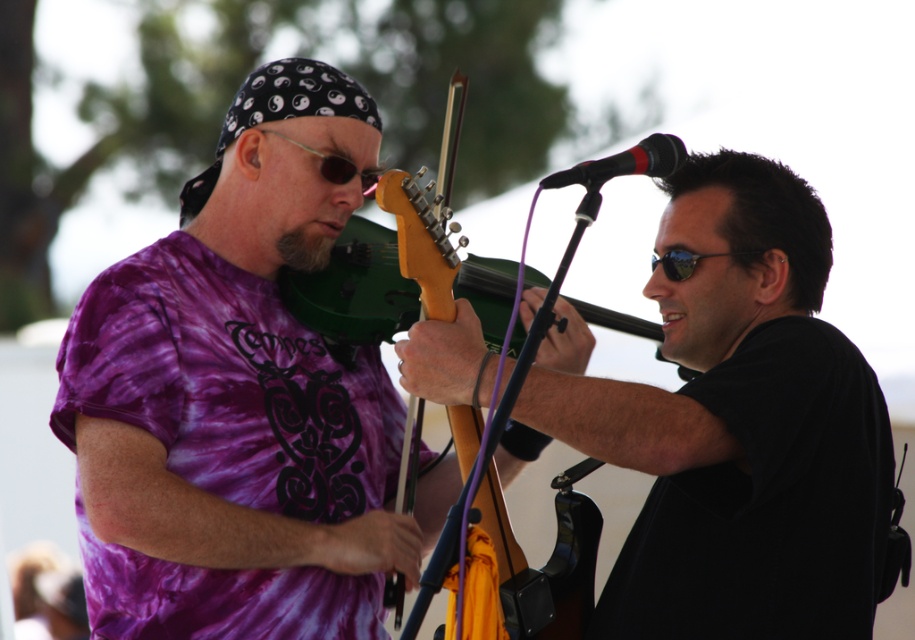
Is matte black guitar at center to the left of green matte violin at center from the viewer's perspective?

In fact, matte black guitar at center is to the right of green matte violin at center.

Who is lower down, matte black guitar at center or green matte violin at center?

matte black guitar at center

This screenshot has width=915, height=640. Describe the element at coordinates (739, 426) in the screenshot. I see `matte black guitar at center` at that location.

The height and width of the screenshot is (640, 915). Identify the location of matte black guitar at center. (739, 426).

Which is above, purple tie-dye shirt at center or green matte violin at center?

green matte violin at center is above.

Image resolution: width=915 pixels, height=640 pixels. What are the coordinates of `purple tie-dye shirt at center` in the screenshot? It's located at (241, 397).

Where is `purple tie-dye shirt at center`? purple tie-dye shirt at center is located at coordinates (241, 397).

Where is `purple tie-dye shirt at center`? This screenshot has width=915, height=640. purple tie-dye shirt at center is located at coordinates (241, 397).

Where is `purple tie-dye shirt at center`? The image size is (915, 640). purple tie-dye shirt at center is located at coordinates (x=241, y=397).

Measure the distance between purple tie-dye shirt at center and camera.

The distance of purple tie-dye shirt at center from camera is 8.52 feet.

Identify the location of purple tie-dye shirt at center. (241, 397).